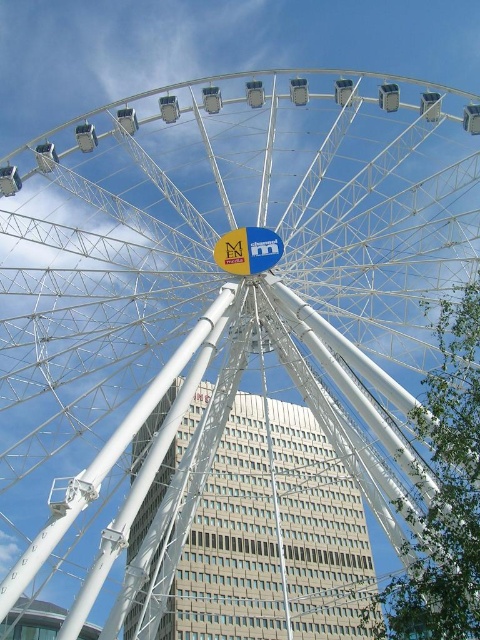
Question: Can you confirm if white metallic pole at center is positioned to the left of yellow fabric sign at center?

Choices:
 (A) no
 (B) yes

Answer: (B)

Question: Can you confirm if white metallic pole at center is positioned to the right of yellow fabric sign at center?

Choices:
 (A) yes
 (B) no

Answer: (B)

Question: Which point is farther to the camera?

Choices:
 (A) white metallic pole at center
 (B) yellow fabric sign at center

Answer: (B)

Question: Which point is farther to the camera?

Choices:
 (A) yellow fabric sign at center
 (B) beige glass building at center

Answer: (A)

Question: Is beige glass building at center further to the viewer compared to yellow fabric sign at center?

Choices:
 (A) yes
 (B) no

Answer: (B)

Question: Which point appears farthest from the camera in this image?

Choices:
 (A) (192, 570)
 (B) (204, 320)
 (C) (222, 266)

Answer: (A)